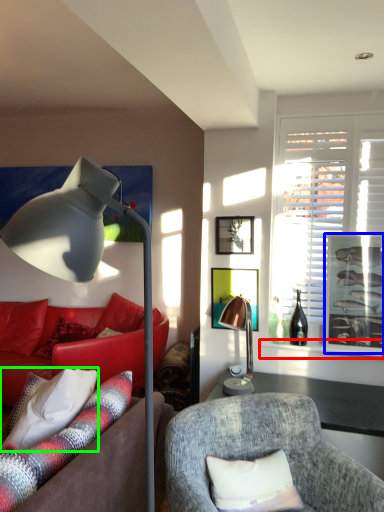
Question: Which object is the farthest from window sill (highlighted by a red box)? Choose among these: picture frame (highlighted by a blue box) or pillow (highlighted by a green box).

Choices:
 (A) picture frame
 (B) pillow

Answer: (B)